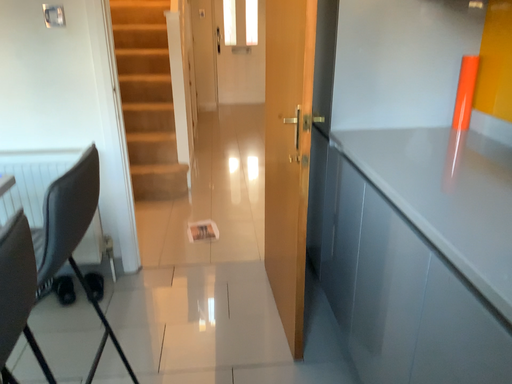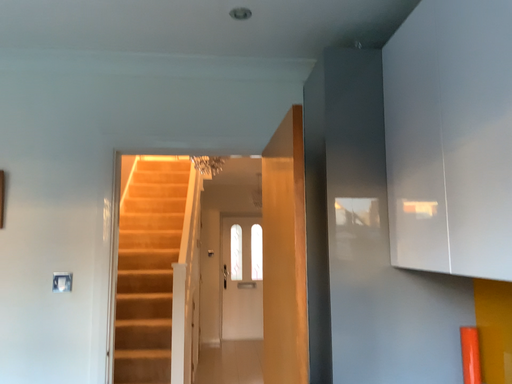
Question: How did the camera likely rotate when shooting the video?

Choices:
 (A) rotated upward
 (B) rotated downward

Answer: (A)